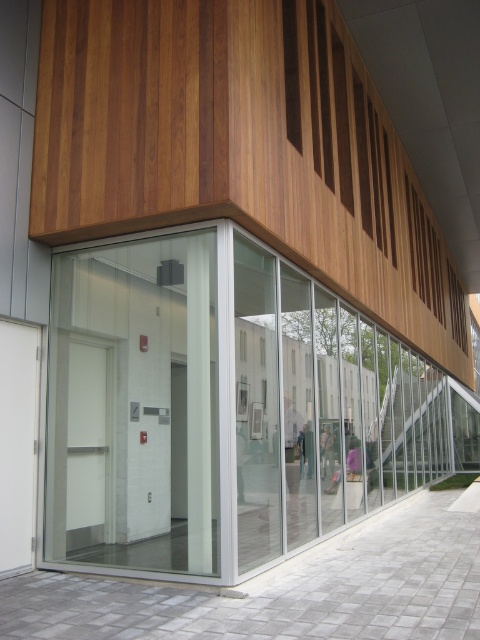
You are standing in front of the building and see the point at coordinates (226, 406). Based on the scene description, can you determine what object this point is located on?

The point at coordinates (226, 406) is on the transparent glass door at center.

You are standing outside the building and want to enter. There is a transparent glass door at center and a transparent glass elevator at center. Which one should you approach to enter the building?

The transparent glass door at center is positioned under the transparent glass elevator at center, so you should approach the transparent glass door at center to enter the building since doors are typically located at ground level.

You are standing in front of the modern building and notice two points marked on the facade. The first point is at coordinates point (157, 394) and the second is at point (155, 545). Which point is closer to you?

Point (157, 394) is closer to you because it is further to the viewer than point (155, 545).